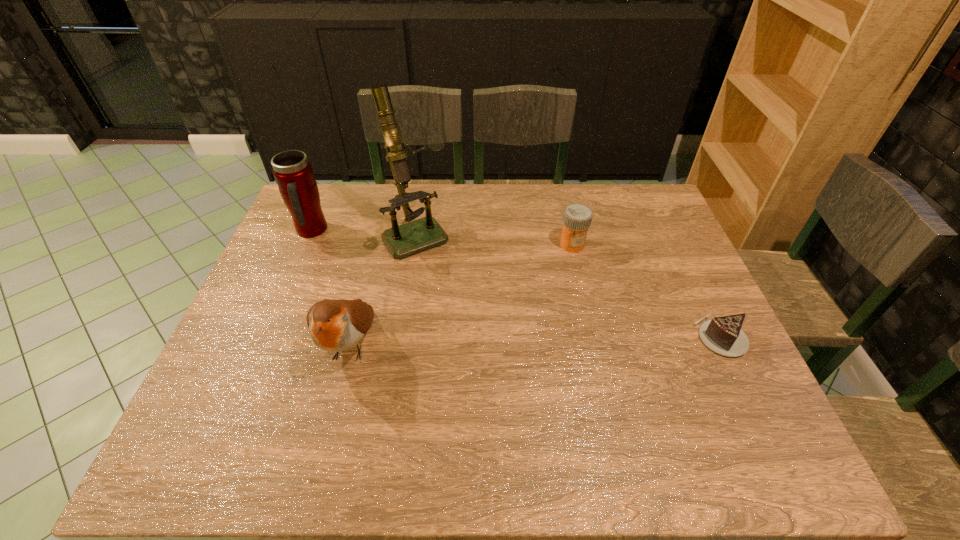
You are a GUI agent. You are given a task and a screenshot of the screen. Output one action in this format:
    pyautogui.click(x=<x>, y=<y>)
    Task: Click on the bird
    This screenshot has height=540, width=960.
    Given the screenshot: What is the action you would take?
    pyautogui.click(x=336, y=325)

You are a GUI agent. You are given a task and a screenshot of the screen. Output one action in this format:
    pyautogui.click(x=<x>, y=<y>)
    Task: Click on the rightmost object
    The image size is (960, 540).
    Given the screenshot: What is the action you would take?
    pyautogui.click(x=723, y=335)

Where is `chocolate cake`? This screenshot has height=540, width=960. chocolate cake is located at coordinates (723, 335).

Identify the location of the tallest object. The width and height of the screenshot is (960, 540). (403, 240).

Locate an element on the screen. The image size is (960, 540). the fourth object from left to right is located at coordinates (577, 217).

Identify the location of the fourth tallest object. (577, 217).

In order to click on thermos bottle in this screenshot , I will do `click(293, 173)`.

At what (x,y) coordinates should I click in order to perform the action: click on the fourth shortest object. Please return your answer as a coordinate pair (x, y). This screenshot has height=540, width=960. Looking at the image, I should click on (293, 173).

Identify the location of vacant space located 0.290m on the left of the shortest object. (581, 336).

Image resolution: width=960 pixels, height=540 pixels. I want to click on free region located 0.370m at the eyepiece of the microscope, so click(x=492, y=346).